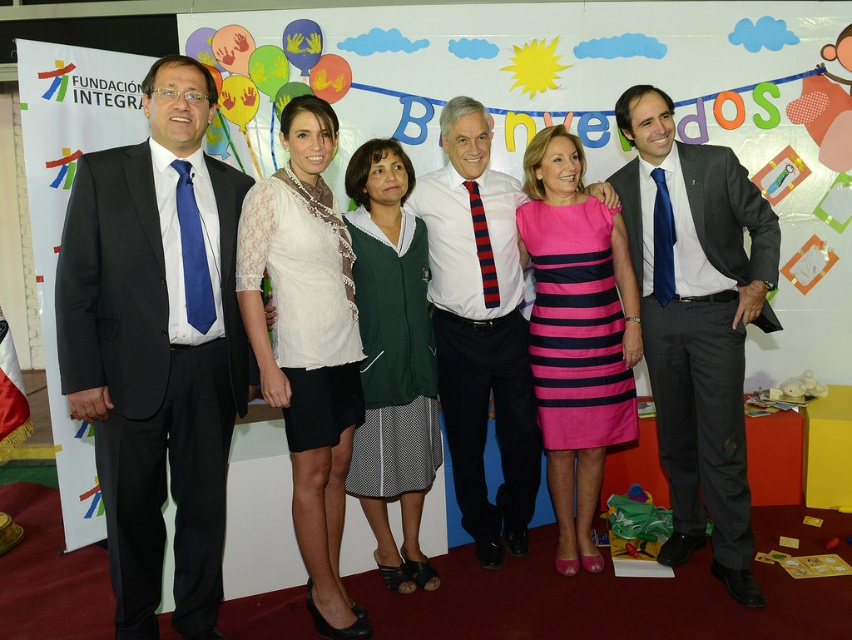
Between white shirt at center and white lace top at center, which one appears on the right side from the viewer's perspective?

white shirt at center

In the scene shown: How distant is white shirt at center from white lace top at center?

8.75 inches

Measure the distance between point (494, 212) and camera.

A distance of 2.70 meters exists between point (494, 212) and camera.

Where is `white shirt at center`? Image resolution: width=852 pixels, height=640 pixels. white shirt at center is located at coordinates (481, 330).

Does black suit at left appear under white lace top at center?

No, black suit at left is not below white lace top at center.

Describe the element at coordinates (157, 346) in the screenshot. I see `black suit at left` at that location.

Where is `black suit at left`? This screenshot has height=640, width=852. black suit at left is located at coordinates (157, 346).

Who is positioned more to the right, black suit at left or pink striped dress at center?

Positioned to the right is pink striped dress at center.

Which is behind, point (68, 289) or point (570, 236)?

Positioned behind is point (570, 236).

Find the location of a particular element. The image size is (852, 640). black suit at left is located at coordinates (157, 346).